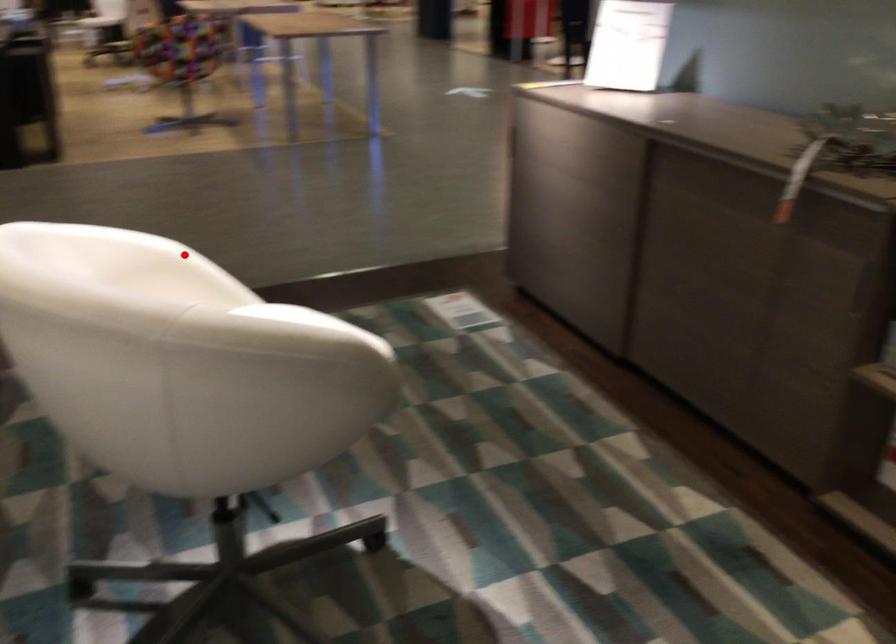
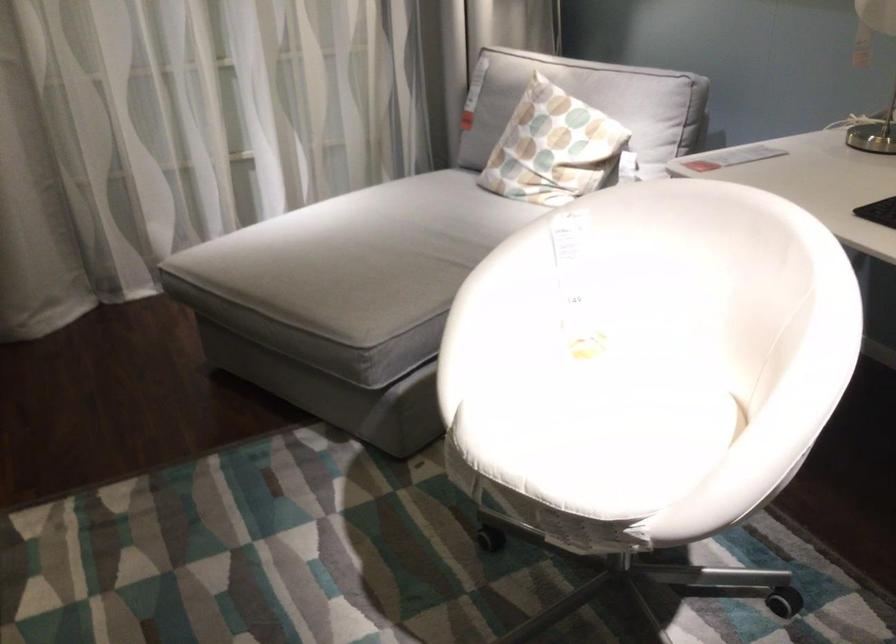
Question: I am providing you with two images of the same scene from different viewpoints. Given a red point in image1, look at the same physical point in image2. Is it:

Choices:
 (A) Closer to the viewpoint
 (B) Farther from the viewpoint

Answer: (A)